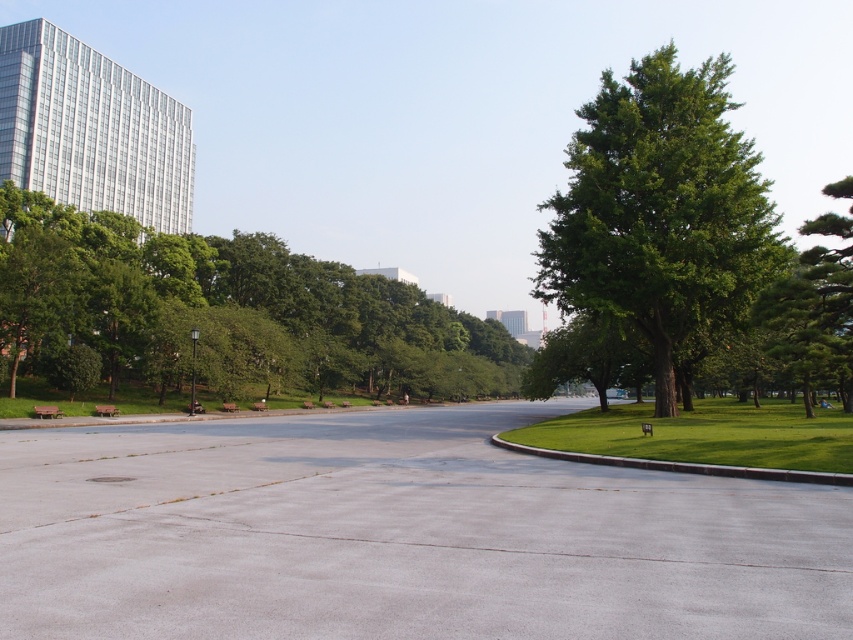
Who is shorter, green leafy tree at left or green leafy tree at right?

green leafy tree at left is shorter.

Is point (187, 310) positioned before point (735, 236)?

No.

Between point (250, 294) and point (698, 321), which one is positioned in front?

Positioned in front is point (698, 321).

This screenshot has height=640, width=853. Identify the location of green leafy tree at left. (228, 310).